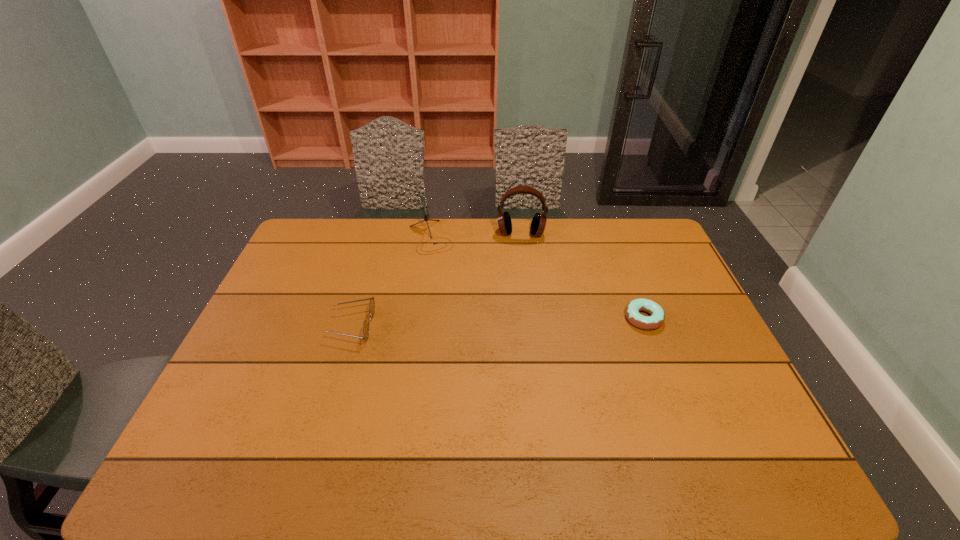
Locate an element on the screen. This screenshot has width=960, height=540. vacant area that lies between the second tallest object and the second object from right to left is located at coordinates (476, 235).

Locate an element on the screen. Image resolution: width=960 pixels, height=540 pixels. empty space that is in between the rightmost object and the headset is located at coordinates (582, 276).

Find the location of a particular element. vacant point located between the second object from left to right and the spectacles is located at coordinates (392, 281).

Image resolution: width=960 pixels, height=540 pixels. I want to click on free space between the microphone and the tallest object, so click(476, 235).

I want to click on free space that is in between the tallest object and the microphone, so click(x=476, y=235).

Identify the location of free point between the second object from left to right and the doughnut. (537, 278).

Locate which object is the closest to the leftmost object. Please provide its 2D coordinates. Your answer should be formatted as a tuple, i.e. [(x, y)], where the tuple contains the x and y coordinates of a point satisfying the conditions above.

[(423, 202)]

You are a GUI agent. You are given a task and a screenshot of the screen. Output one action in this format:
    pyautogui.click(x=<x>, y=<y>)
    Task: Click on the closest object to the spectacles
    
    Given the screenshot: What is the action you would take?
    pyautogui.click(x=423, y=202)